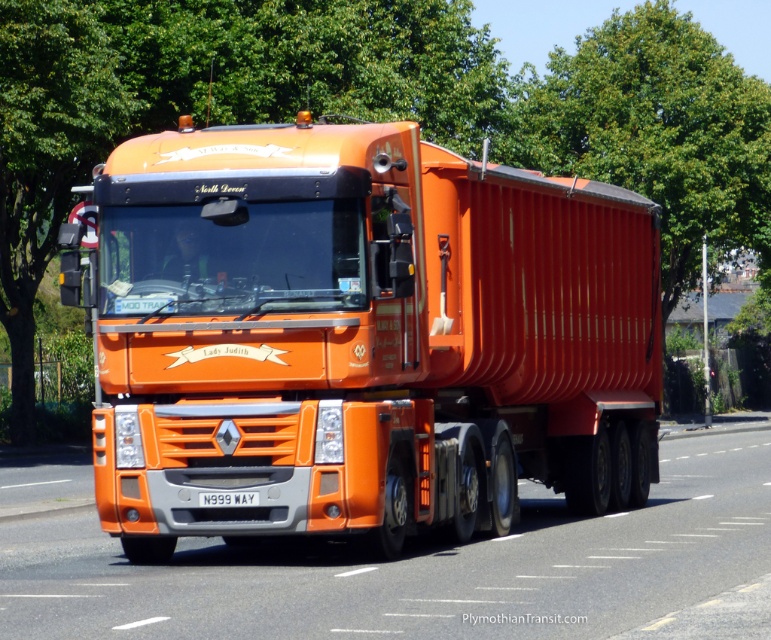
You are a traffic controller at a roundabout and need to direct an orange matte trailer truck at center to exit at the second exit. The roundabout has three exits. The truck is currently at position coordinates point 0.527, 0.472. The exits are located at positions 0.3, 0.5 for the first exit, 0.6, 0.4 for the second exit, and 0.4, 0.6 for the third exit. Can the truck reach the second exit without crossing any other exits?

The orange matte trailer truck at center is at position coordinates point (362,337). The second exit is at (308,384). Since the truck is already very close to the second exit coordinates, it can reach the second exit without crossing other exits.

You are a pedestrian standing on the sidewalk observing the orange matte trailer truck at center and the orange glossy truck at center on the road. Which truck is closer to you?

The orange matte trailer truck at center is closer to you because the orange glossy truck at center is behind it.

You are a delivery driver who needs to ensure that the distance between the orange glossy truck at center and the white plastic license plate at center is within safety regulations. The regulation states that the license plate must be no more than 10 feet away from the truck. Is the current distance compliant?

The orange glossy truck at center and white plastic license plate at center are 10.48 feet apart from each other. Since 10.48 feet exceeds the maximum allowed distance of 10 feet, the current distance is not compliant with safety regulations.